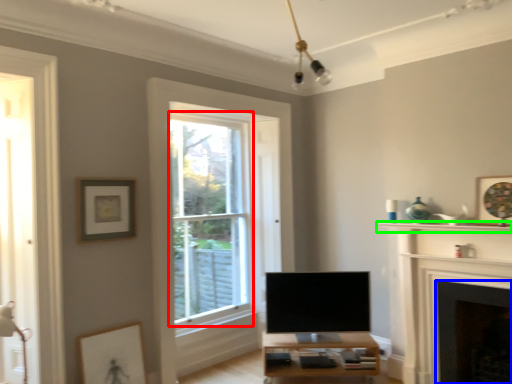
Question: Which is farther away from bay window (highlighted by a red box)? fireplace (highlighted by a blue box) or shelf (highlighted by a green box)?

Choices:
 (A) fireplace
 (B) shelf

Answer: (A)